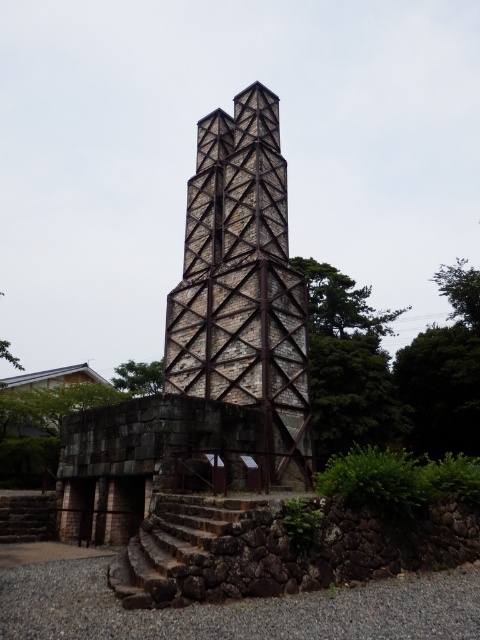
Question: Which of the following is the farthest from the observer?

Choices:
 (A) (397, 310)
 (B) (145, 380)
 (C) (477, 275)

Answer: (A)

Question: Is stone textured bell tower at center wider than green leafy tree at upper center?

Choices:
 (A) yes
 (B) no

Answer: (B)

Question: Which point appears farthest from the camera in this image?

Choices:
 (A) (124, 572)
 (B) (214, 211)
 (C) (330, 310)

Answer: (C)

Question: Estimate the real-world distances between objects in this image. Which object is closer to the brown stone stairs at lower center?

Choices:
 (A) stone textured bell tower at center
 (B) green leafy tree at upper right
 (C) green leafy tree at upper center

Answer: (A)

Question: Is stone textured bell tower at center thinner than green leafy tree at upper right?

Choices:
 (A) no
 (B) yes

Answer: (B)

Question: Is green leafy tree at upper center to the right of green leafy tree at upper right from the viewer's perspective?

Choices:
 (A) no
 (B) yes

Answer: (A)